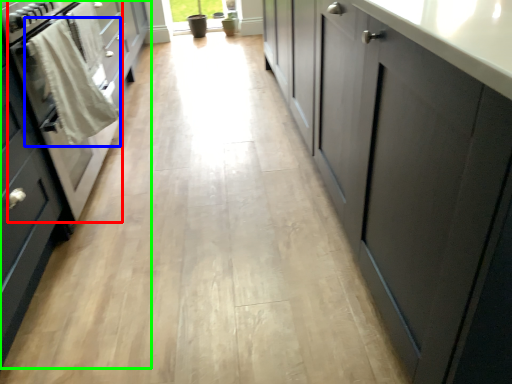
Question: Based on their relative distances, which object is nearer to oven (highlighted by a red box)? Choose from laundry (highlighted by a blue box) and cabinetry (highlighted by a green box).

Choices:
 (A) laundry
 (B) cabinetry

Answer: (A)